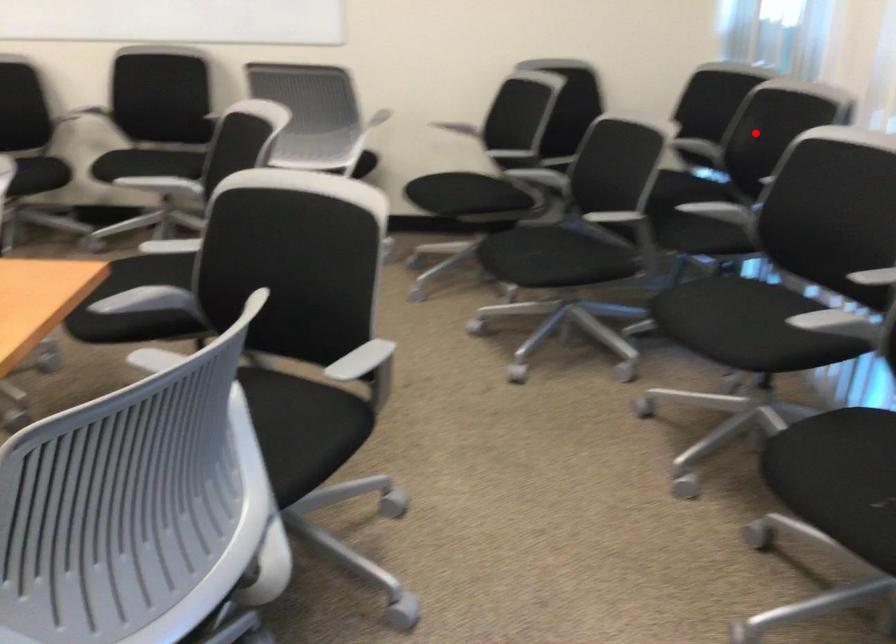
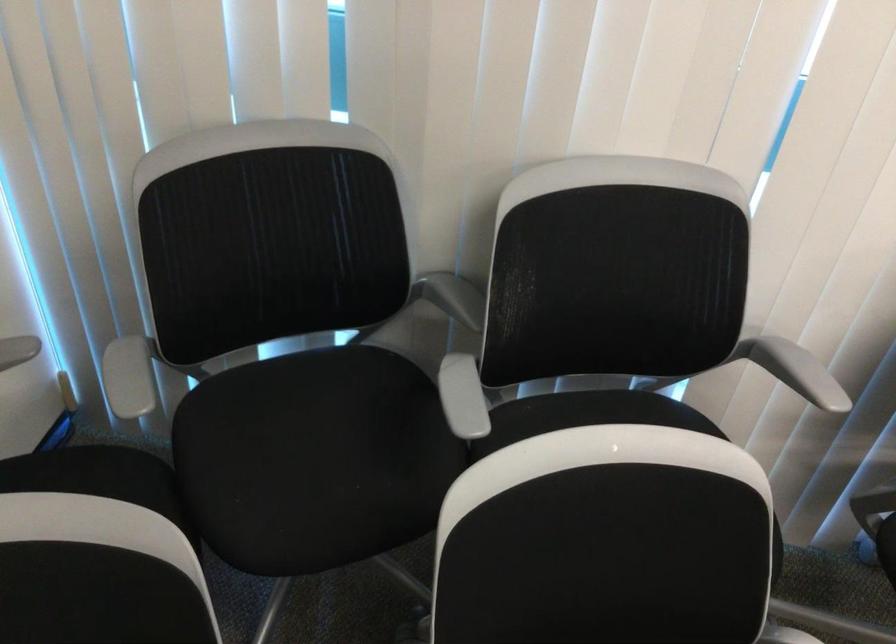
Question: I am providing you with two images of the same scene from different viewpoints. Image1 has a red point marked. In image2, the corresponding 3D location appears at what relative position? Reply with the corresponding letter.

Choices:
 (A) Closer
 (B) Farther

Answer: (A)